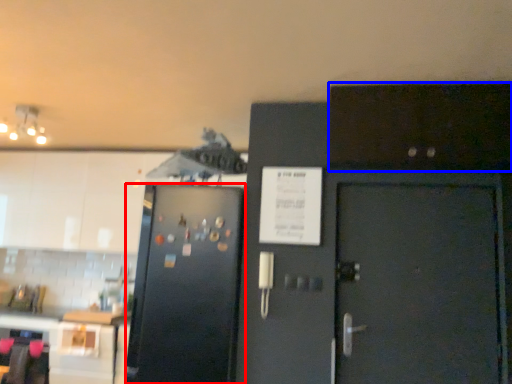
Question: Which of the following is the farthest to the observer, refrigerator (highlighted by a red box) or cabinetry (highlighted by a blue box)?

Choices:
 (A) refrigerator
 (B) cabinetry

Answer: (A)